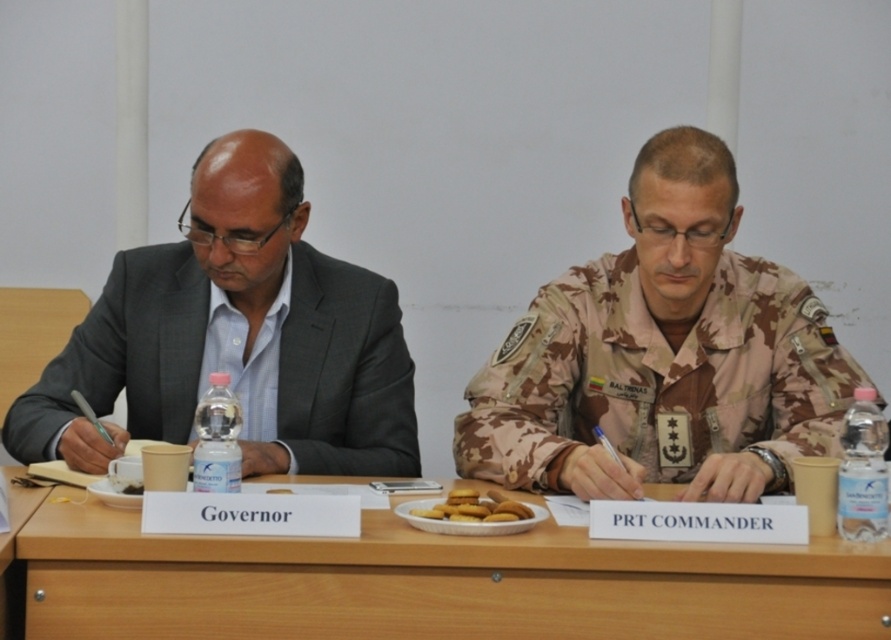
Question: Does wooden table at lower left appear on the right side of golden matte cookies at center?

Choices:
 (A) no
 (B) yes

Answer: (A)

Question: Is brown wooden table at center wider than golden matte cookies at center?

Choices:
 (A) yes
 (B) no

Answer: (A)

Question: Among these objects, which one is farthest from the camera?

Choices:
 (A) wooden table at lower left
 (B) brown wooden table at center
 (C) golden matte cookies at center
 (D) camouflage fabric uniform at center

Answer: (D)

Question: Estimate the real-world distances between objects in this image. Which object is closer to the brown wooden table at center?

Choices:
 (A) camouflage fabric uniform at center
 (B) matte gray suit at left
 (C) wooden table at lower left

Answer: (C)

Question: Estimate the real-world distances between objects in this image. Which object is farther from the matte gray suit at left?

Choices:
 (A) golden matte cookies at center
 (B) camouflage fabric uniform at center
 (C) wooden table at lower left

Answer: (A)

Question: Can you confirm if camouflage fabric uniform at center is bigger than wooden table at lower left?

Choices:
 (A) yes
 (B) no

Answer: (A)